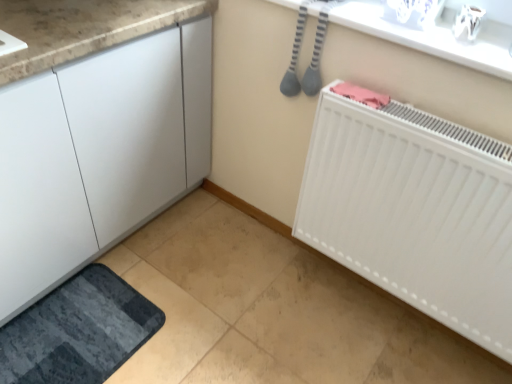
Question: Considering the positions of white matte radiator at lower right and white glossy counter top at upper center in the image, is white matte radiator at lower right wider or thinner than white glossy counter top at upper center?

Choices:
 (A) wide
 (B) thin

Answer: (B)

Question: From a real-world perspective, is white matte radiator at lower right above or below white glossy counter top at upper center?

Choices:
 (A) below
 (B) above

Answer: (A)

Question: Which of these objects is positioned closest to the white glossy counter top at upper center?

Choices:
 (A) white matte radiator at lower right
 (B) dark gray textured bath mat at lower left

Answer: (A)

Question: Estimate the real-world distances between objects in this image. Which object is closer to the dark gray textured bath mat at lower left?

Choices:
 (A) white glossy counter top at upper center
 (B) white matte radiator at lower right

Answer: (B)